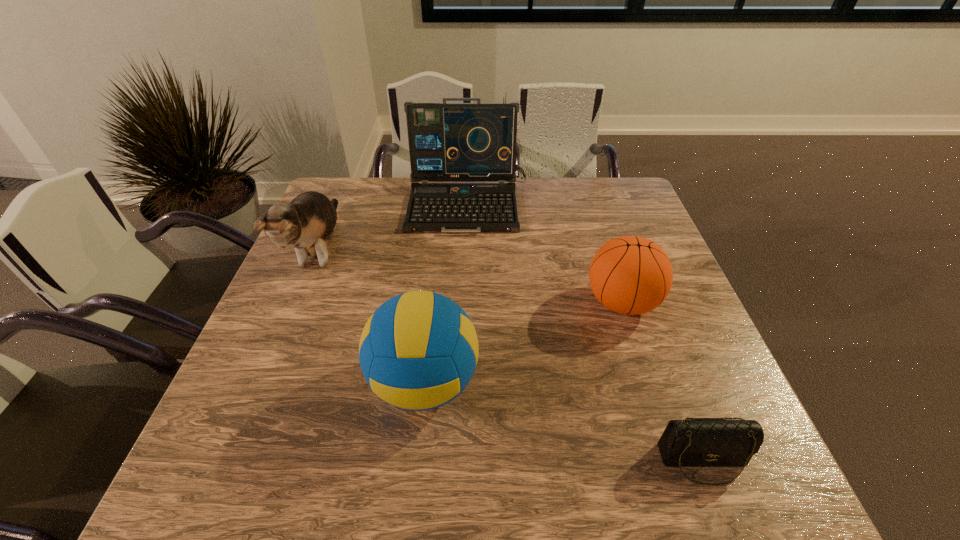
This screenshot has width=960, height=540. I want to click on the tallest object, so click(448, 142).

The height and width of the screenshot is (540, 960). I want to click on the leftmost object, so (x=306, y=223).

Where is `the second nearest object`? This screenshot has width=960, height=540. the second nearest object is located at coordinates (418, 351).

What are the coordinates of `basketball` in the screenshot? It's located at (631, 275).

Find the location of a particular element. The image size is (960, 540). the shortest object is located at coordinates (700, 442).

This screenshot has width=960, height=540. What are the coordinates of `the nearest object` in the screenshot? It's located at (700, 442).

Where is `blank area located 0.220m on the front-facing side of the laptop computer`? blank area located 0.220m on the front-facing side of the laptop computer is located at coordinates (465, 289).

Identify the location of free region located 0.110m at the face of the leftmost object. (281, 340).

Where is `blank space located on the back of the fourth farthest object`? This screenshot has width=960, height=540. blank space located on the back of the fourth farthest object is located at coordinates (433, 302).

The image size is (960, 540). What are the coordinates of `vacant space located on the left of the fourth tallest object` in the screenshot? It's located at (437, 302).